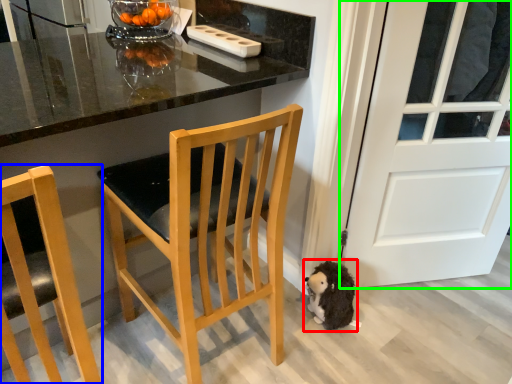
Question: Estimate the real-world distances between objects in this image. Which object is closer to animal (highlighted by a red box), chair (highlighted by a blue box) or door (highlighted by a green box)?

Choices:
 (A) chair
 (B) door

Answer: (B)